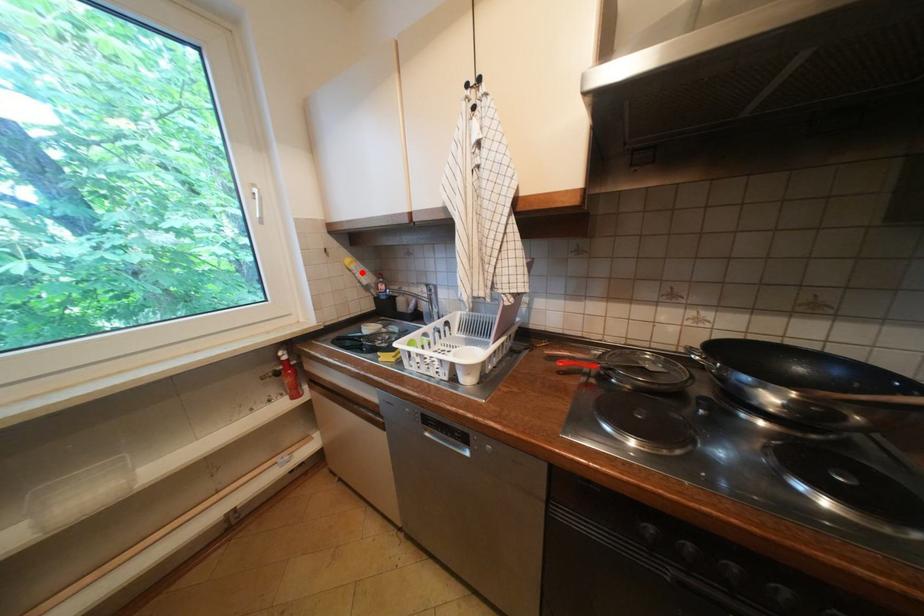
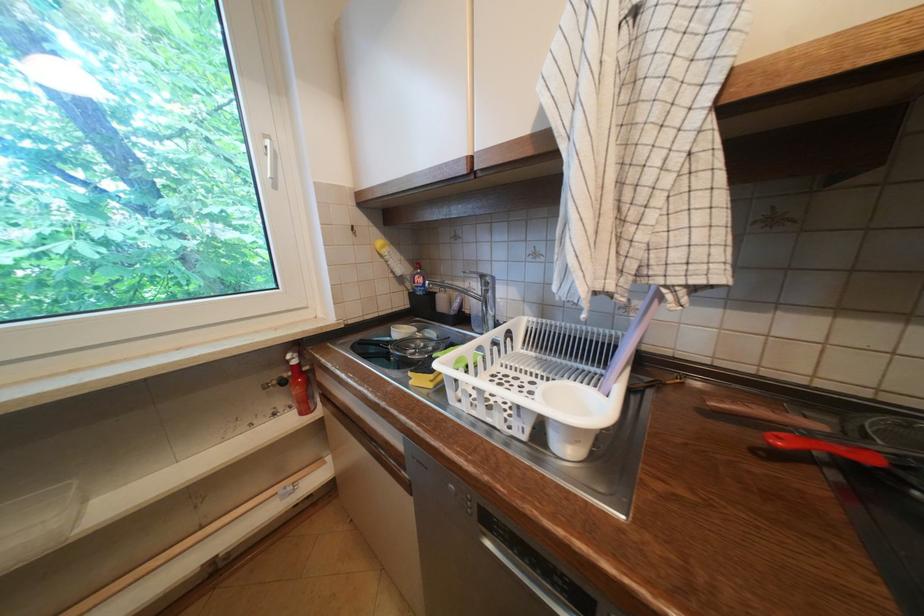
In the second image, find the point that corresponds to the highlighted location in the first image.

(394, 259)